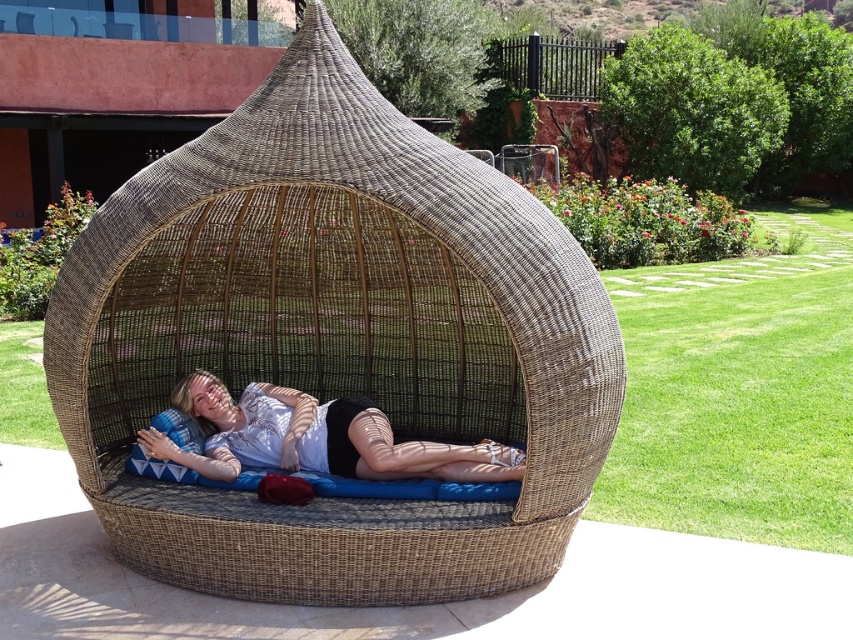
Which of these two, woven rattan basket at center or matte white shirt at center, stands shorter?

With less height is matte white shirt at center.

Who is lower down, woven rattan basket at center or matte white shirt at center?

matte white shirt at center is lower down.

Who is more distant from viewer, (492, 177) or (204, 381)?

Point (204, 381)

This screenshot has height=640, width=853. Identify the location of woven rattan basket at center. (335, 340).